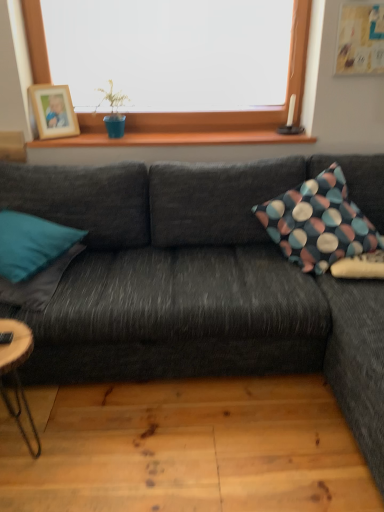
Locate an element on the screen. The width and height of the screenshot is (384, 512). teal fabric pillow at left, the second pillow viewed from the left is located at coordinates (38, 283).

What do you see at coordinates (187, 448) in the screenshot?
I see `natural wood plank at lower center` at bounding box center [187, 448].

Describe the element at coordinates (202, 283) in the screenshot. This screenshot has width=384, height=512. I see `dark gray fabric couch at center` at that location.

The image size is (384, 512). In order to click on dark gray fabric couch at center in this screenshot , I will do `click(202, 283)`.

Image resolution: width=384 pixels, height=512 pixels. Identify the location of wooden natural coffee table at lower left. (16, 371).

Based on the photo, would you say polka dot fabric pillow at right, marked as the third pillow in a left-to-right arrangement, is outside natural wood plank at lower center?

Yes.

Considering the positions of objects polka dot fabric pillow at right, placed as the first pillow when sorted from right to left, and natural wood plank at lower center in the image provided, who is more to the right, polka dot fabric pillow at right, placed as the first pillow when sorted from right to left, or natural wood plank at lower center?

From the viewer's perspective, polka dot fabric pillow at right, placed as the first pillow when sorted from right to left, appears more on the right side.

Which object is more forward, polka dot fabric pillow at right, marked as the third pillow in a left-to-right arrangement, or natural wood plank at lower center?

natural wood plank at lower center is closer to the camera.

Would you consider wooden photo frame at upper left to be distant from teal fabric pillow at left, marked as the 3th pillow in a right-to-left arrangement?

No, there isn't a large distance between wooden photo frame at upper left and teal fabric pillow at left, marked as the 3th pillow in a right-to-left arrangement.

Is wooden photo frame at upper left facing away from teal fabric pillow at left, marked as the 3th pillow in a right-to-left arrangement?

No, wooden photo frame at upper left is not facing away from teal fabric pillow at left, marked as the 3th pillow in a right-to-left arrangement.

From the image's perspective, does wooden photo frame at upper left appear lower than teal fabric pillow at left, marked as the 3th pillow in a right-to-left arrangement?

No.

Considering the relative sizes of wooden photo frame at upper left and teal fabric pillow at left, arranged as the 1th pillow when viewed from the left, in the image provided, is wooden photo frame at upper left taller than teal fabric pillow at left, arranged as the 1th pillow when viewed from the left,?

Indeed, wooden photo frame at upper left has a greater height compared to teal fabric pillow at left, arranged as the 1th pillow when viewed from the left.

Is teal fabric pillow at left, the second pillow viewed from the left, bigger than wooden natural coffee table at lower left?

Yes.

Which is correct: teal fabric pillow at left, the second pillow viewed from the left, is inside wooden natural coffee table at lower left, or outside of it?

teal fabric pillow at left, the second pillow viewed from the left, is not inside wooden natural coffee table at lower left, it's outside.

Does teal fabric pillow at left, the second pillow positioned from the right, lie behind wooden natural coffee table at lower left?

Yes, teal fabric pillow at left, the second pillow positioned from the right, is further from the viewer.

Could you measure the distance between teal fabric pillow at left, the second pillow positioned from the right, and wooden natural coffee table at lower left?

A distance of 10.58 inches exists between teal fabric pillow at left, the second pillow positioned from the right, and wooden natural coffee table at lower left.

Where is `plank that appears below the dark gray fabric couch at center (from a real-world perspective)`? Image resolution: width=384 pixels, height=512 pixels. plank that appears below the dark gray fabric couch at center (from a real-world perspective) is located at coordinates (187, 448).

Is natural wood plank at lower center facing away from dark gray fabric couch at center?

Answer: That's not correct — natural wood plank at lower center is not looking away from dark gray fabric couch at center.

Which is correct: natural wood plank at lower center is inside dark gray fabric couch at center, or outside of it?

natural wood plank at lower center lies outside dark gray fabric couch at center.

Measure the distance from natural wood plank at lower center to dark gray fabric couch at center.

A distance of 38.82 centimeters exists between natural wood plank at lower center and dark gray fabric couch at center.

At what (x,y) coordinates should I click in order to perform the action: click on studio couch below the teal fabric pillow at left, the second pillow viewed from the left (from a real-world perspective). Please return your answer as a coordinate pair (x, y). Looking at the image, I should click on (202, 283).

Does teal fabric pillow at left, the second pillow viewed from the left, touch dark gray fabric couch at center?

No.

Is teal fabric pillow at left, the second pillow positioned from the right, positioned with its back to dark gray fabric couch at center?

Yes, teal fabric pillow at left, the second pillow positioned from the right,'s orientation is away from dark gray fabric couch at center.

Does teal fabric pillow at left, the second pillow viewed from the left, have a greater width compared to dark gray fabric couch at center?

In fact, teal fabric pillow at left, the second pillow viewed from the left, might be narrower than dark gray fabric couch at center.

Is point (313, 226) positioned before point (13, 276)?

That is False.

Could you measure the distance between polka dot fabric pillow at right, placed as the first pillow when sorted from right to left, and teal fabric pillow at left, marked as the 3th pillow in a right-to-left arrangement?

polka dot fabric pillow at right, placed as the first pillow when sorted from right to left, is 1.06 meters from teal fabric pillow at left, marked as the 3th pillow in a right-to-left arrangement.

Locate an element on the screen. pillow that is the 2nd one when counting rightward from the teal fabric pillow at left, marked as the 3th pillow in a right-to-left arrangement is located at coordinates (318, 223).

Is teal fabric pillow at left, marked as the 3th pillow in a right-to-left arrangement, a part of polka dot fabric pillow at right, marked as the third pillow in a left-to-right arrangement?

Actually, teal fabric pillow at left, marked as the 3th pillow in a right-to-left arrangement, is outside polka dot fabric pillow at right, marked as the third pillow in a left-to-right arrangement.

From their relative heights in the image, would you say wooden photo frame at upper left is taller or shorter than teal fabric pillow at left, the second pillow viewed from the left?

In the image, wooden photo frame at upper left appears to be taller than teal fabric pillow at left, the second pillow viewed from the left.

From the image's perspective, is wooden photo frame at upper left positioned above or below teal fabric pillow at left, the second pillow positioned from the right?

Clearly, from the image's perspective, wooden photo frame at upper left is above teal fabric pillow at left, the second pillow positioned from the right.

Based on the photo, which is behind, wooden photo frame at upper left or teal fabric pillow at left, the second pillow positioned from the right?

Positioned behind is wooden photo frame at upper left.

From a real-world perspective, which pillow is the 3rd one above the natural wood plank at lower center? Please provide its 2D coordinates.

[(318, 223)]

Find the location of a particular element. picture frame on the right side of teal fabric pillow at left, marked as the 3th pillow in a right-to-left arrangement is located at coordinates (53, 111).

When comparing their distances from dark gray fabric couch at center, does polka dot fabric pillow at right, placed as the first pillow when sorted from right to left, or teal fabric pillow at left, marked as the 3th pillow in a right-to-left arrangement, seem further?

teal fabric pillow at left, marked as the 3th pillow in a right-to-left arrangement.

Based on their spatial positions, is natural wood plank at lower center or wooden photo frame at upper left further from teal fabric pillow at left, the second pillow positioned from the right?

wooden photo frame at upper left is further to teal fabric pillow at left, the second pillow positioned from the right.

Based on their spatial positions, is teal fabric pillow at left, the second pillow viewed from the left, or natural wood plank at lower center further from dark gray fabric couch at center?

The object further to dark gray fabric couch at center is teal fabric pillow at left, the second pillow viewed from the left.

Estimate the real-world distances between objects in this image. Which object is further from dark gray fabric couch at center, teal fabric pillow at left, the second pillow viewed from the left, or wooden natural coffee table at lower left?

wooden natural coffee table at lower left lies further to dark gray fabric couch at center than the other object.

Looking at the image, which one is located further to teal fabric pillow at left, the second pillow positioned from the right, dark gray fabric couch at center or wooden natural coffee table at lower left?

dark gray fabric couch at center is further to teal fabric pillow at left, the second pillow positioned from the right.

Estimate the real-world distances between objects in this image. Which object is closer to natural wood plank at lower center, dark gray fabric couch at center or polka dot fabric pillow at right, marked as the third pillow in a left-to-right arrangement?

dark gray fabric couch at center.

Considering their positions, is wooden natural coffee table at lower left positioned closer to teal fabric pillow at left, marked as the 3th pillow in a right-to-left arrangement, than polka dot fabric pillow at right, marked as the third pillow in a left-to-right arrangement?

Based on the image, wooden natural coffee table at lower left appears to be nearer to teal fabric pillow at left, marked as the 3th pillow in a right-to-left arrangement.

Looking at the image, which one is located further to wooden photo frame at upper left, polka dot fabric pillow at right, placed as the first pillow when sorted from right to left, or natural wood plank at lower center?

Based on the image, natural wood plank at lower center appears to be further to wooden photo frame at upper left.

Identify the location of coffee table between wooden photo frame at upper left and natural wood plank at lower center vertically. (16, 371).

What are the coordinates of `coffee table situated between wooden photo frame at upper left and polka dot fabric pillow at right, marked as the third pillow in a left-to-right arrangement, from left to right` in the screenshot? It's located at (16, 371).

The height and width of the screenshot is (512, 384). Identify the location of studio couch between wooden photo frame at upper left and wooden natural coffee table at lower left in the up-down direction. tap(202, 283).

The width and height of the screenshot is (384, 512). I want to click on window sill between wooden natural coffee table at lower left and polka dot fabric pillow at right, placed as the first pillow when sorted from right to left, so click(x=175, y=139).